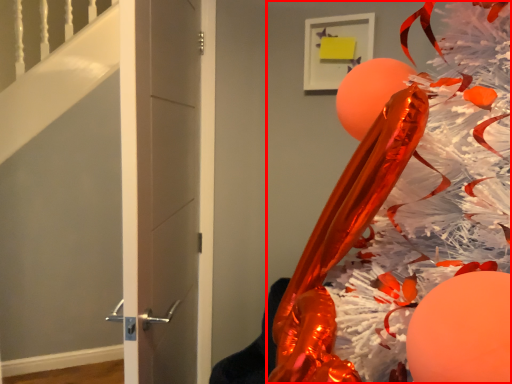
Question: Observing the image, what is the correct spatial positioning of christmas tree (annotated by the red box) in reference to door?

Choices:
 (A) right
 (B) left

Answer: (A)